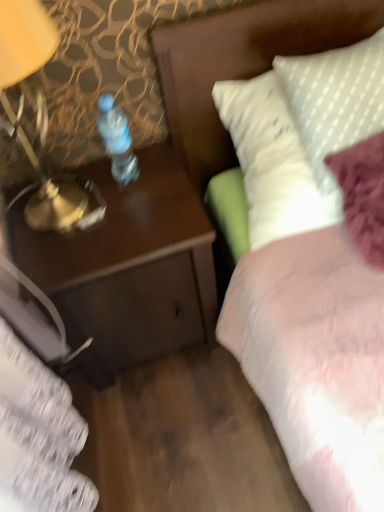
Image resolution: width=384 pixels, height=512 pixels. In order to click on vacant space to the left of clear plastic bottle at center in this screenshot , I will do `click(69, 190)`.